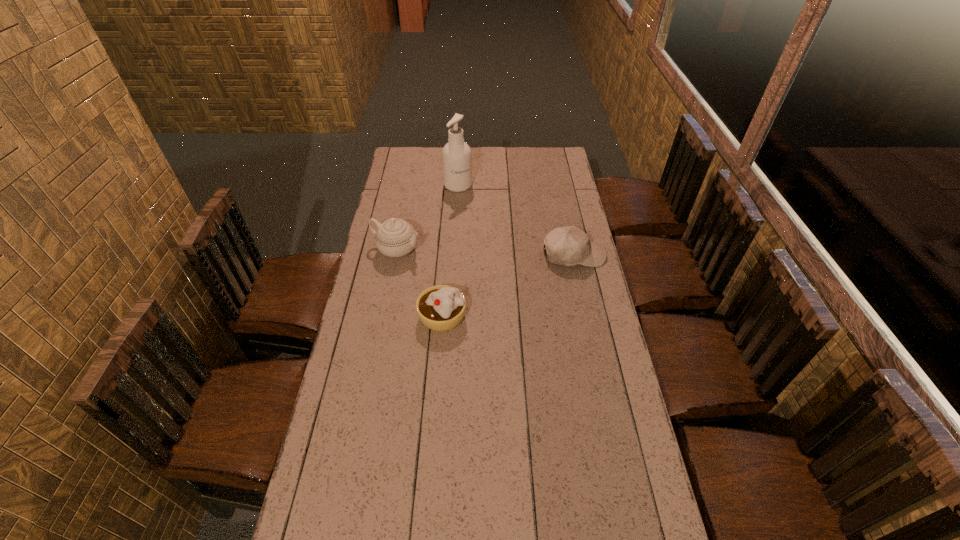
At what (x,y) coordinates should I click in order to perform the action: click on the nearest object. Please return your answer as a coordinate pair (x, y). Looking at the image, I should click on (442, 307).

Locate an element on the screen. The width and height of the screenshot is (960, 540). the rightmost object is located at coordinates (569, 245).

I want to click on the tallest object, so click(456, 155).

This screenshot has height=540, width=960. In order to click on cleansing agent in this screenshot , I will do `click(456, 155)`.

Identify the location of chinaware. click(395, 237).

Find the location of a particular element. the third shortest object is located at coordinates (395, 237).

Locate an element on the screen. free space located on the right of the nearest object is located at coordinates (533, 316).

At what (x,y) coordinates should I click in order to perform the action: click on free location located 0.360m on the front label of the tallest object. Please return your answer as a coordinate pair (x, y). Looking at the image, I should click on (487, 240).

Image resolution: width=960 pixels, height=540 pixels. I want to click on vacant space positioned 0.270m on the front label of the tallest object, so 480,227.

Locate an element on the screen. free space located 0.050m on the front label of the tallest object is located at coordinates (466, 199).